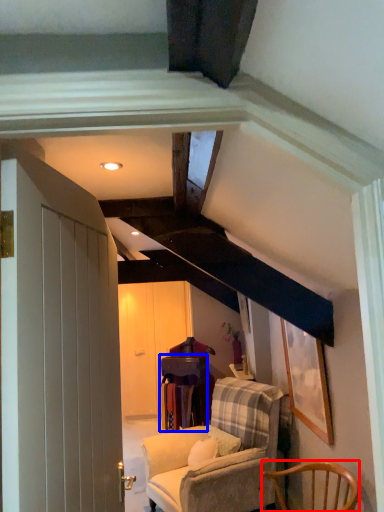
Question: Which object is closer to the camera taking this photo, chair (highlighted by a red box) or table (highlighted by a blue box)?

Choices:
 (A) chair
 (B) table

Answer: (A)